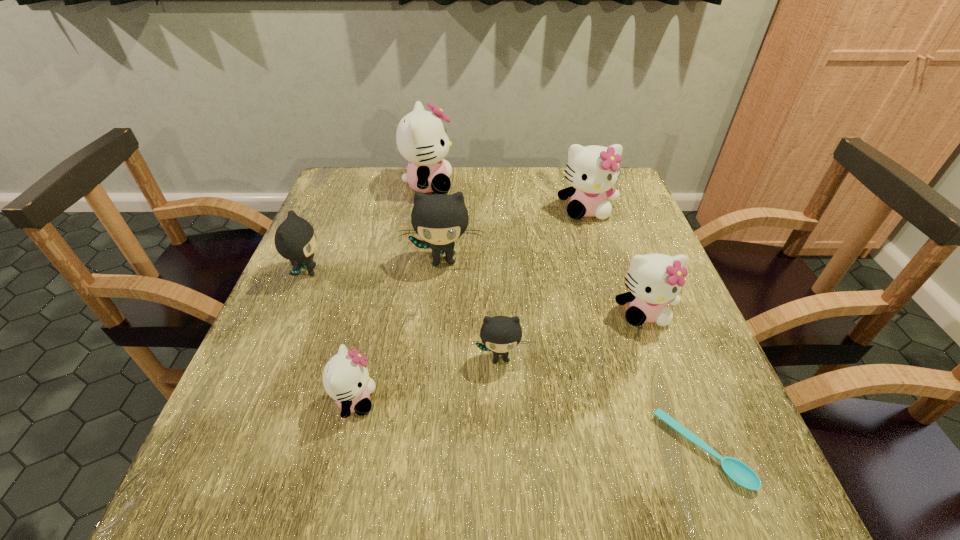
Identify the location of vacant space at the right edge of the desktop. (x=619, y=255).

At what (x,y) coordinates should I click in order to perform the action: click on free spot at the far left corner of the desktop. Please return your answer as a coordinate pair (x, y). The height and width of the screenshot is (540, 960). Looking at the image, I should click on (351, 171).

The image size is (960, 540). In the image, there is a desktop. What are the coordinates of `free space at the near left corner` in the screenshot? It's located at (213, 487).

What are the coordinates of `vacant area between the sixth farthest kitten and the nearest white kitten` in the screenshot? It's located at (427, 379).

Locate an element on the screen. free space between the sixth farthest kitten and the tallest kitten is located at coordinates (464, 271).

This screenshot has height=540, width=960. What are the coordinates of `free space between the fifth farthest object and the spoon` in the screenshot? It's located at (672, 381).

Where is `vacant area that lies between the sixth farthest object and the spoon`? The image size is (960, 540). vacant area that lies between the sixth farthest object and the spoon is located at coordinates (601, 404).

Where is `unoccupied area between the nearest white kitten and the fifth farthest object`? Image resolution: width=960 pixels, height=540 pixels. unoccupied area between the nearest white kitten and the fifth farthest object is located at coordinates (499, 356).

Identify the location of vacant space that's between the leftmost kitten and the fifth farthest object. (475, 292).

Find the location of a particular element. unoccupied area between the nearest white kitten and the blue spoon is located at coordinates (528, 426).